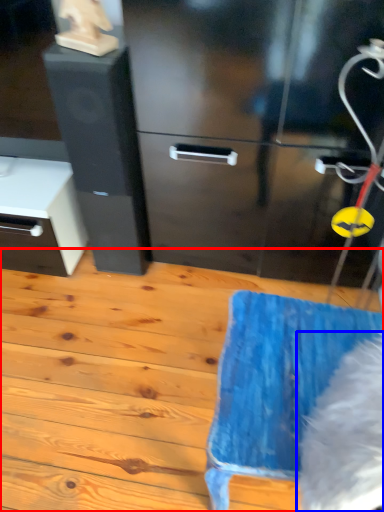
Question: Which object is further to the camera taking this photo, wood (highlighted by a red box) or animal (highlighted by a blue box)?

Choices:
 (A) wood
 (B) animal

Answer: (A)